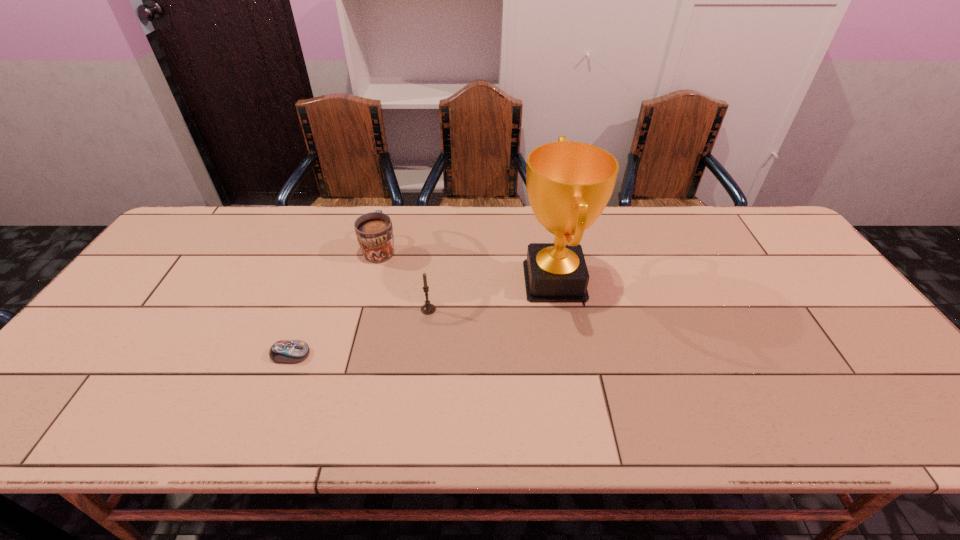
Where is `vacant space at the far right corner of the desktop`? vacant space at the far right corner of the desktop is located at coordinates (766, 215).

Where is `vacant space at the near right corner of the desktop`? The width and height of the screenshot is (960, 540). vacant space at the near right corner of the desktop is located at coordinates (912, 414).

At what (x,y) coordinates should I click in order to perform the action: click on unoccupied area between the second object from left to right and the tallest object. Please return your answer as a coordinate pair (x, y). Looking at the image, I should click on (468, 265).

Identify the location of free point between the tallest object and the computer mouse. (422, 318).

You are a GUI agent. You are given a task and a screenshot of the screen. Output one action in this format:
    pyautogui.click(x=<x>, y=<y>)
    Task: Click on the free space between the second object from right to left and the second object from left to right
    
    Given the screenshot: What is the action you would take?
    pyautogui.click(x=404, y=279)

The height and width of the screenshot is (540, 960). Find the location of `vacant space that is in between the mug and the candle`. vacant space that is in between the mug and the candle is located at coordinates (404, 279).

Identify the location of unoccupied area between the candle and the computer mouse. (359, 332).

Image resolution: width=960 pixels, height=540 pixels. Identify the location of free space between the rightmost object and the candle. (492, 295).

Where is `vacant space that's between the computer mouse and the third object from right to left`? This screenshot has width=960, height=540. vacant space that's between the computer mouse and the third object from right to left is located at coordinates (335, 301).

At what (x,y) coordinates should I click in order to perform the action: click on vacant space that's between the third object from right to left and the nearest object. Please return your answer as a coordinate pair (x, y). Looking at the image, I should click on (335, 301).